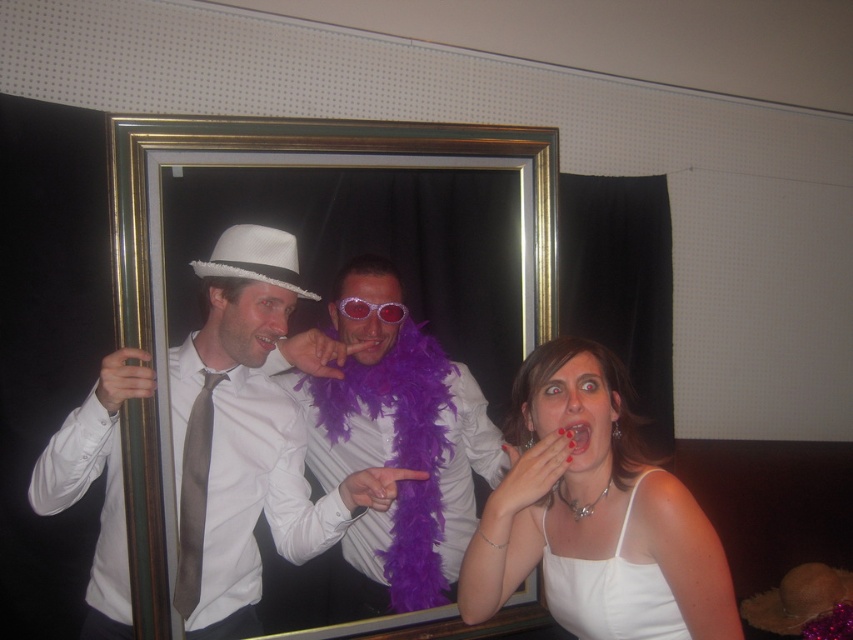
You are standing in front of the mirror at the party and want to adjust your purple feather boa at center. Which direction should you move your hand to reach it based on the mirror reflection?

The purple feather boa at center is located at point (395, 436) in the mirror reflection, so you should move your hand towards the center area to reach it.

You are a photographer at the party and want to ensure that the matte white hat at center and the white fabric tank top at lower right are both visible in the photo. Which object should you focus on to ensure both are in frame?

The matte white hat at center is bigger than the white fabric tank top at lower right, so focusing on the matte white hat at center will ensure both are visible in the photo.